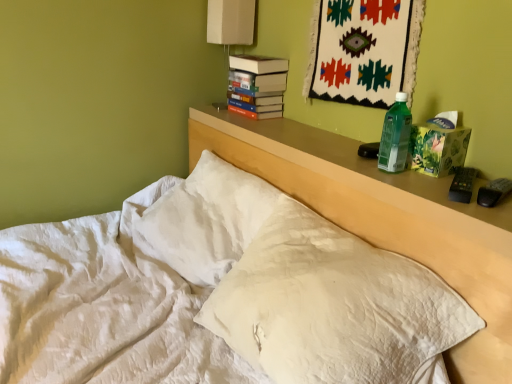
Question: From the image's perspective, is green plastic bottle at right located above or below white quilted bed at center?

Choices:
 (A) above
 (B) below

Answer: (A)

Question: Considering the positions of green plastic bottle at right and white quilted bed at center in the image, is green plastic bottle at right bigger or smaller than white quilted bed at center?

Choices:
 (A) big
 (B) small

Answer: (B)

Question: Which of these objects is positioned farthest from the white fabric lampshade at upper center?

Choices:
 (A) green plastic bottle at right
 (B) white quilted bed at center
 (C) white quilted pillow at center
 (D) hardcover books at upper center

Answer: (C)

Question: Estimate the real-world distances between objects in this image. Which object is closer to the green plastic bottle at right?

Choices:
 (A) white fabric lampshade at upper center
 (B) hardcover books at upper center
 (C) white quilted pillow at center
 (D) white quilted bed at center

Answer: (D)